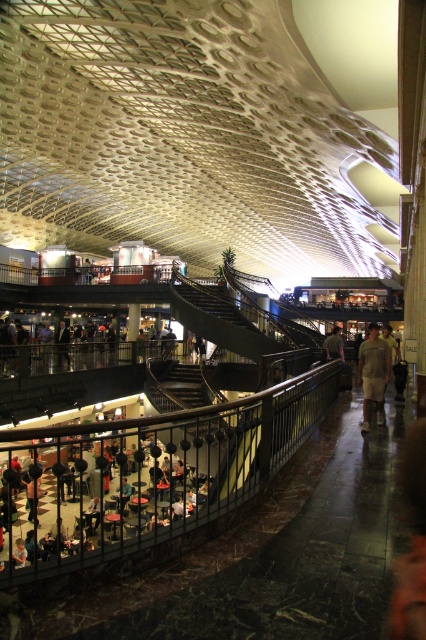
Question: Is dark brown wooden stairs at center to the left of dark gray suit at center from the viewer's perspective?

Choices:
 (A) no
 (B) yes

Answer: (A)

Question: Is black metal railing at center wider than khaki cotton pants at center?

Choices:
 (A) yes
 (B) no

Answer: (A)

Question: Among these objects, which one is nearest to the camera?

Choices:
 (A) dark gray suit at center
 (B) matte black shirt at lower center
 (C) black metal railing at center
 (D) khaki cotton pants at center

Answer: (C)

Question: Which point is closer to the camera taking this photo?

Choices:
 (A) (164, 369)
 (B) (293, 435)
 (C) (63, 346)

Answer: (B)

Question: Which object is farther from the camera taking this photo?

Choices:
 (A) matte black shirt at lower center
 (B) dark brown wooden stairs at center
 (C) brown leather jacket at center
 (D) black metal railing at center

Answer: (C)

Question: Does black metal railing at center appear under khaki cotton pants at center?

Choices:
 (A) no
 (B) yes

Answer: (B)